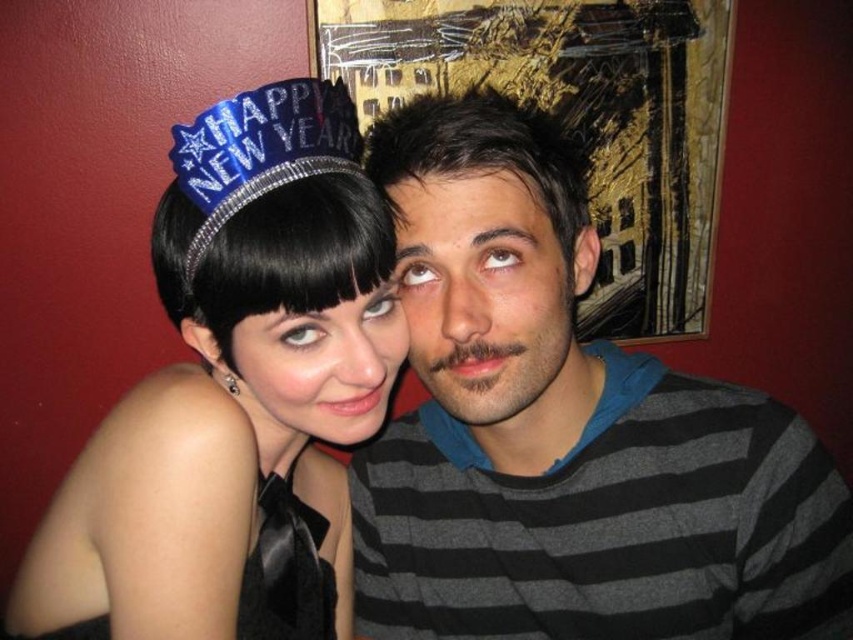
Based on the photo, between gray striped sweater at center and blue sequined crown at upper left, which one is positioned lower?

Positioned lower is gray striped sweater at center.

Measure the distance between gray striped sweater at center and camera.

They are 20.65 inches apart.

Locate an element on the screen. The image size is (853, 640). gray striped sweater at center is located at coordinates (566, 433).

Is dark brown hair at center to the left of blue sequined crown at upper left from the viewer's perspective?

No, dark brown hair at center is not to the left of blue sequined crown at upper left.

From the picture: Can you confirm if dark brown hair at center is positioned below blue sequined crown at upper left?

Correct, dark brown hair at center is located below blue sequined crown at upper left.

Is point (488, 256) positioned in front of point (216, 154)?

Yes, it is.

The height and width of the screenshot is (640, 853). I want to click on dark brown hair at center, so [491, 300].

Can you confirm if gray striped sweater at center is taller than satin black tiara at upper left?

No, gray striped sweater at center is not taller than satin black tiara at upper left.

Can you confirm if gray striped sweater at center is positioned to the right of satin black tiara at upper left?

Correct, you'll find gray striped sweater at center to the right of satin black tiara at upper left.

Is point (361, 600) more distant than point (335, 97)?

Yes.

The image size is (853, 640). Identify the location of gray striped sweater at center. (x=566, y=433).